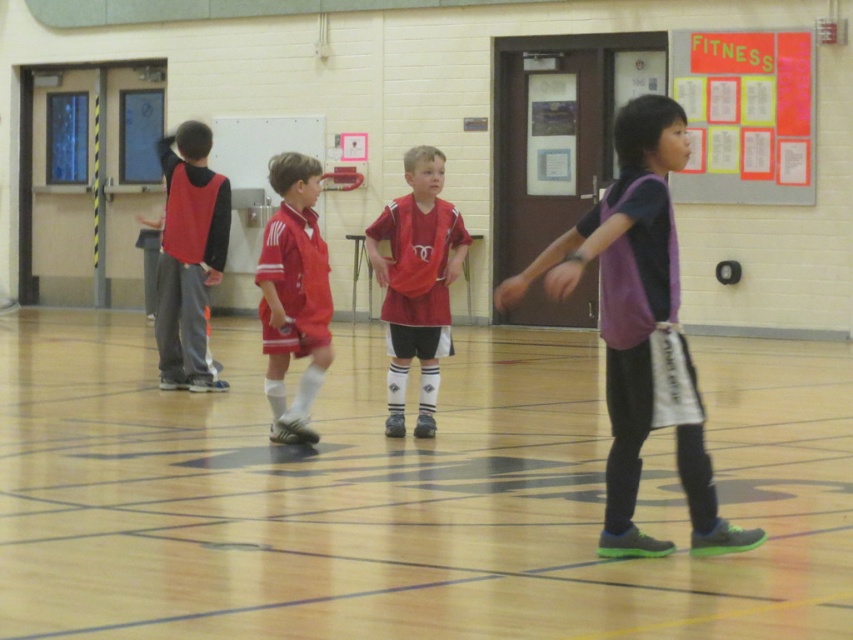
Question: Which object is the farthest from the matte red jersey at left?

Choices:
 (A) wooden floor at center
 (B) bright pink paper at upper right
 (C) matte red jersey at center

Answer: (B)

Question: Does purple matte jersey at right appear over matte red jersey at left?

Choices:
 (A) yes
 (B) no

Answer: (B)

Question: Which of these objects is positioned closest to the bright pink paper at upper right?

Choices:
 (A) wooden floor at center
 (B) matte red soccer uniform at center

Answer: (A)

Question: Considering the real-world distances, which object is closest to the matte red soccer uniform at center?

Choices:
 (A) purple matte jersey at right
 (B) matte red jersey at center
 (C) matte red jersey at left

Answer: (B)

Question: Is matte red jersey at center closer to the viewer compared to matte red jersey at left?

Choices:
 (A) no
 (B) yes

Answer: (B)

Question: Is wooden floor at center positioned at the back of matte red soccer uniform at center?

Choices:
 (A) no
 (B) yes

Answer: (A)